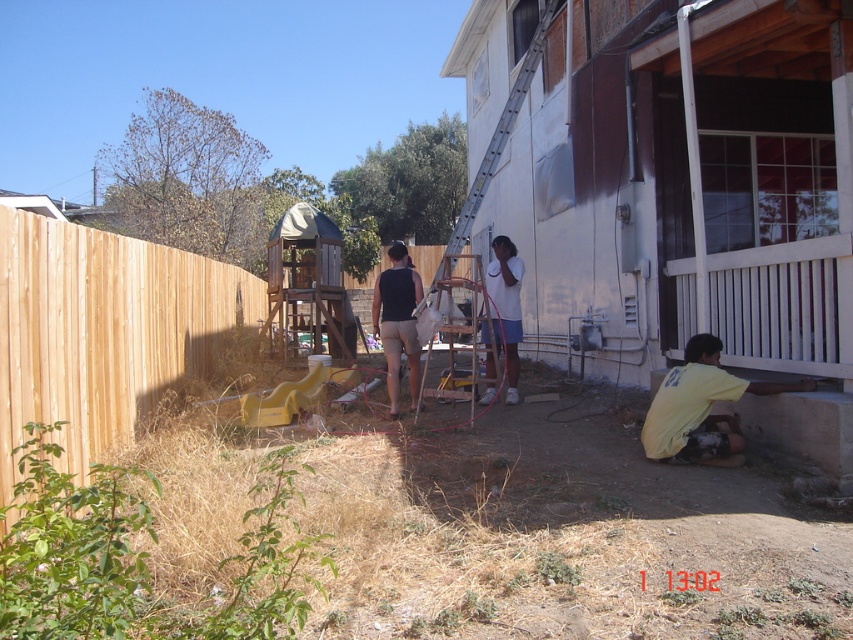
You are standing in the backyard and want to place a small garden ornament between the two points labeled point (x=389, y=326) and point (x=424, y=365). Which point should the ornament be closer to if you want it to appear larger in the camera view?

The ornament should be placed closer to point (x=389, y=326) because it is closer to the camera, making objects placed there appear larger in the camera view.